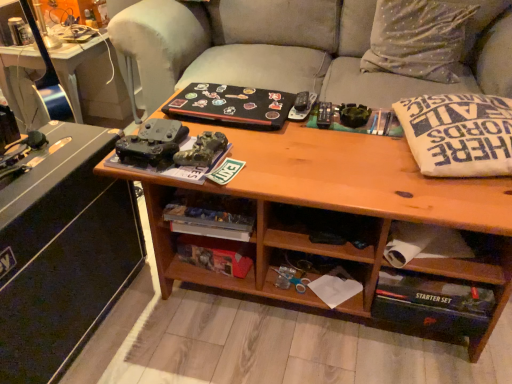
Question: Can you confirm if silky silver pillow at upper right is wider than hardcover book at lower center, which is the first book from bottom to top?

Choices:
 (A) yes
 (B) no

Answer: (A)

Question: Considering the relative positions of silky silver pillow at upper right and hardcover book at lower center, positioned as the 2th book in top-to-bottom order, in the image provided, is silky silver pillow at upper right to the left of hardcover book at lower center, positioned as the 2th book in top-to-bottom order, from the viewer's perspective?

Choices:
 (A) yes
 (B) no

Answer: (B)

Question: Is hardcover book at lower center, which is the first book from bottom to top, inside silky silver pillow at upper right?

Choices:
 (A) yes
 (B) no

Answer: (B)

Question: From the image's perspective, is silky silver pillow at upper right under hardcover book at lower center, positioned as the 2th book in top-to-bottom order?

Choices:
 (A) no
 (B) yes

Answer: (A)

Question: Is silky silver pillow at upper right facing towards hardcover book at lower center, which is the first book from bottom to top?

Choices:
 (A) no
 (B) yes

Answer: (B)

Question: Visually, is matte black desk at left positioned to the left or to the right of gray fabric couch at center?

Choices:
 (A) right
 (B) left

Answer: (B)

Question: Considering the positions of matte black desk at left and gray fabric couch at center in the image, is matte black desk at left wider or thinner than gray fabric couch at center?

Choices:
 (A) wide
 (B) thin

Answer: (B)

Question: Is matte black desk at left taller or shorter than gray fabric couch at center?

Choices:
 (A) tall
 (B) short

Answer: (B)

Question: Is point (74, 251) closer or farther from the camera than point (509, 29)?

Choices:
 (A) farther
 (B) closer

Answer: (B)

Question: Considering the positions of metallic black game controllers at left and hardcover book at lower center, positioned as the 2th book in top-to-bottom order, in the image, is metallic black game controllers at left bigger or smaller than hardcover book at lower center, positioned as the 2th book in top-to-bottom order,?

Choices:
 (A) small
 (B) big

Answer: (B)

Question: Looking at their shapes, would you say metallic black game controllers at left is wider or thinner than hardcover book at lower center, positioned as the 2th book in top-to-bottom order?

Choices:
 (A) thin
 (B) wide

Answer: (B)

Question: Is metallic black game controllers at left in front of or behind hardcover book at lower center, positioned as the 2th book in top-to-bottom order, in the image?

Choices:
 (A) behind
 (B) front

Answer: (A)

Question: Based on their positions, is metallic black game controllers at left located to the left or right of hardcover book at lower center, which is the first book from bottom to top?

Choices:
 (A) right
 (B) left

Answer: (B)

Question: From the image's perspective, is matte black desk at left located above or below black matte book at center, the 1th book from the top?

Choices:
 (A) above
 (B) below

Answer: (B)

Question: Is matte black desk at left taller or shorter than black matte book at center, which ranks as the second book in bottom-to-top order?

Choices:
 (A) tall
 (B) short

Answer: (A)